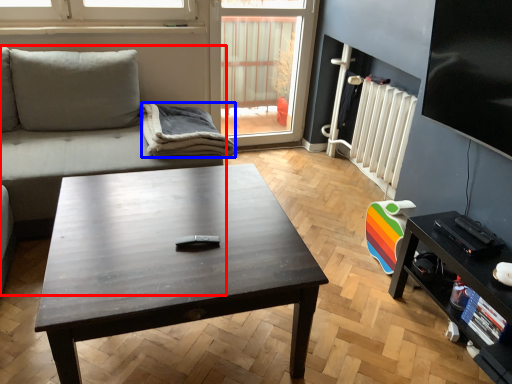
Question: Which object is closer to the camera taking this photo, studio couch (highlighted by a red box) or blanket (highlighted by a blue box)?

Choices:
 (A) studio couch
 (B) blanket

Answer: (A)